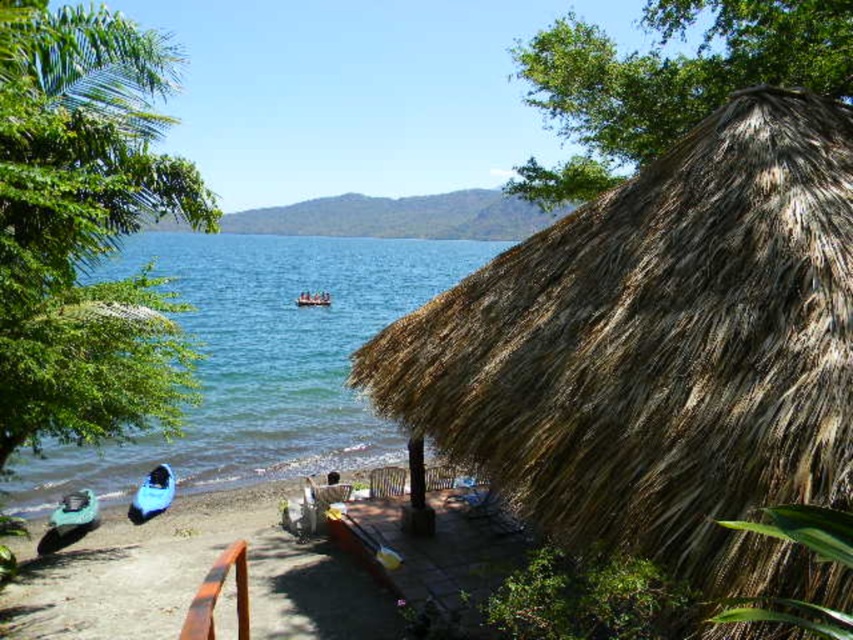
You are standing at the origin point in the image. Which object is located at coordinates point [660,353]?

The point [660,353] corresponds to the brown thatch hut at right.